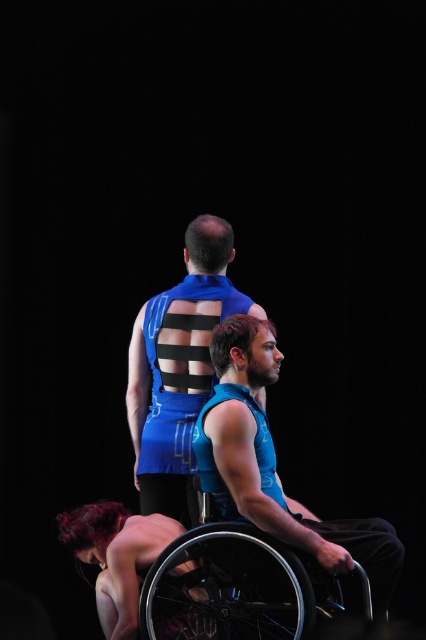
Question: Is blue fabric vest at center to the right of blue matte vest at center from the viewer's perspective?

Choices:
 (A) yes
 (B) no

Answer: (A)

Question: Does blue matte vest at center appear on the right side of smooth skin nude woman at lower left?

Choices:
 (A) no
 (B) yes

Answer: (B)

Question: Which object is positioned closest to the blue matte vest at center?

Choices:
 (A) black metallic wheelchair at lower right
 (B) smooth skin nude woman at lower left
 (C) blue fabric vest at center

Answer: (C)

Question: Which object appears farthest from the camera in this image?

Choices:
 (A) blue matte vest at center
 (B) smooth skin nude woman at lower left
 (C) blue fabric vest at center

Answer: (A)

Question: Which object is positioned farthest from the black metallic wheelchair at lower right?

Choices:
 (A) smooth skin nude woman at lower left
 (B) blue fabric vest at center
 (C) blue matte vest at center

Answer: (C)

Question: Considering the relative positions of blue matte vest at center and smooth skin nude woman at lower left in the image provided, where is blue matte vest at center located with respect to smooth skin nude woman at lower left?

Choices:
 (A) above
 (B) below

Answer: (A)